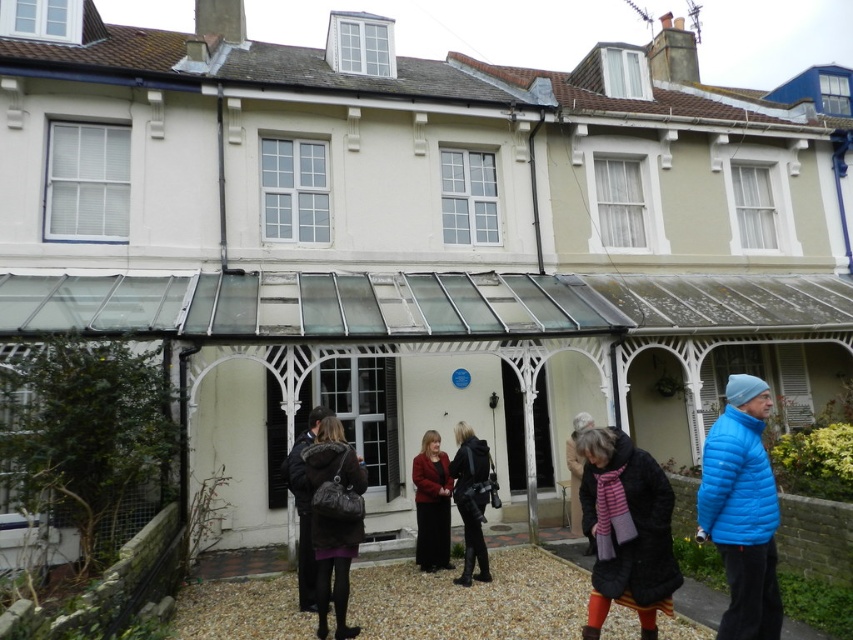
You are a photographer standing at the entrance of the building. You want to take a photo that includes both the blue down jacket at right and the dark gray wool coat at lower left. Which of the two objects should you adjust your camera angle to include first, considering their heights?

The blue down jacket at right is not as tall as the dark gray wool coat at lower left, so you should adjust your camera angle to include the dark gray wool coat at lower left first because it is taller and might require a wider or higher angle to capture it properly.

You are a tour guide leading a group near the building. You notice the black leather jacket at center and the dark gray wool coat at lower left. Which coat is closer to the front of the group?

The black leather jacket at center is closer to the front of the group because the dark gray wool coat at lower left is behind it.